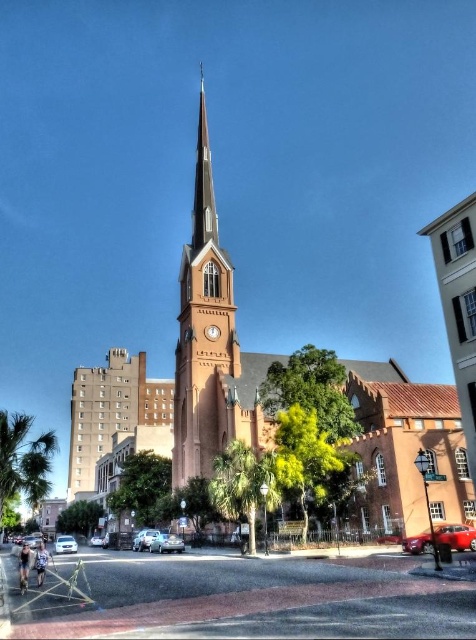
Based on the photo, you are a delivery person who needs to park your 15 feet long truck between the matte brick church at center and the metallic silver sedan at center. Is there enough space between them to park your truck?

The distance between the matte brick church at center and the metallic silver sedan at center is 207.02 feet, which is more than enough space to park a 15 feet long truck between them.

You are a photographer trying to capture the entire brick steeple at center and metallic silver sedan at lower left in a single frame. Based on their widths, which object should you position closer to the center of your camera viewfinder to ensure both fit without cropping?

The brick steeple at center is wider than the metallic silver sedan at lower left. To capture both in a single frame without cropping, position the brick steeple at center closer to the center of the camera viewfinder since it requires more space.

You are standing on the street in front of the church and want to take a photo that includes both the brick steeple at center and the green leafy palm tree at lower left. Which object should you position closer to the edge of the frame to ensure both are fully visible?

To ensure both the brick steeple at center and the green leafy palm tree at lower left are fully visible in the photo, position the green leafy palm tree at lower left closer to the edge of the frame since the brick steeple at center is taller and requires more vertical space.